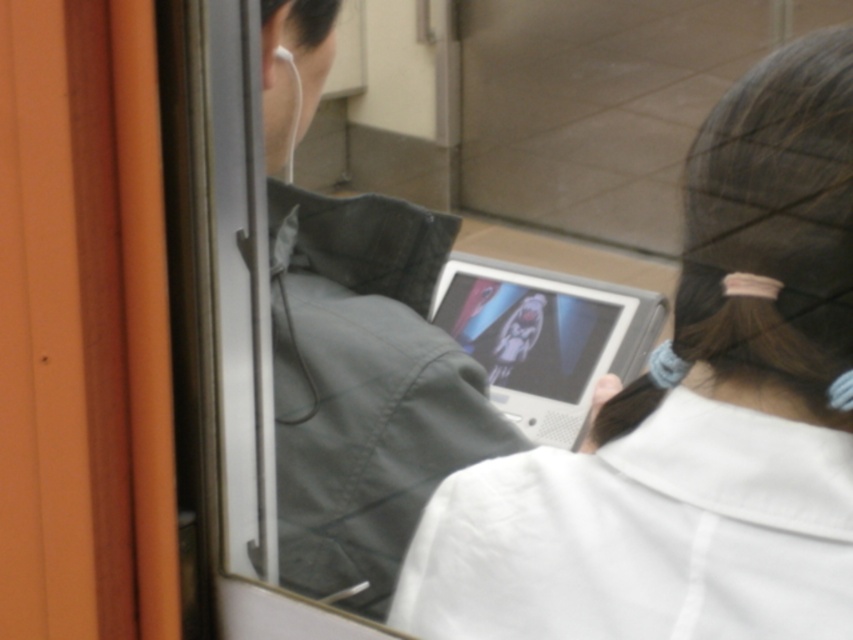
Question: Is silver metallic tablet at center positioned at the back of white matte earphone at upper left?

Choices:
 (A) yes
 (B) no

Answer: (A)

Question: Based on their relative distances, which object is farther from the white matte laptop at center?

Choices:
 (A) dark gray fabric jacket at center
 (B) silver metallic tablet at center

Answer: (B)

Question: Is dark gray fabric jacket at center behind silver metallic tablet at center?

Choices:
 (A) no
 (B) yes

Answer: (A)

Question: Is white matte laptop at center above white matte earphone at upper left?

Choices:
 (A) yes
 (B) no

Answer: (B)

Question: Which object is farther from the camera taking this photo?

Choices:
 (A) white matte laptop at center
 (B) dark gray fabric jacket at center
 (C) silver metallic tablet at center

Answer: (C)

Question: Among these points, which one is farthest from the camera?

Choices:
 (A) (608, 552)
 (B) (292, 129)
 (C) (310, 54)

Answer: (C)